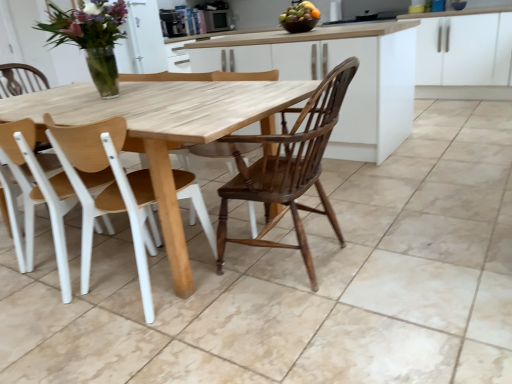
Image resolution: width=512 pixels, height=384 pixels. Find the location of `vacant area that is in front of white plastic chair at left, acting as the second chair starting from the right`. vacant area that is in front of white plastic chair at left, acting as the second chair starting from the right is located at coordinates (54, 322).